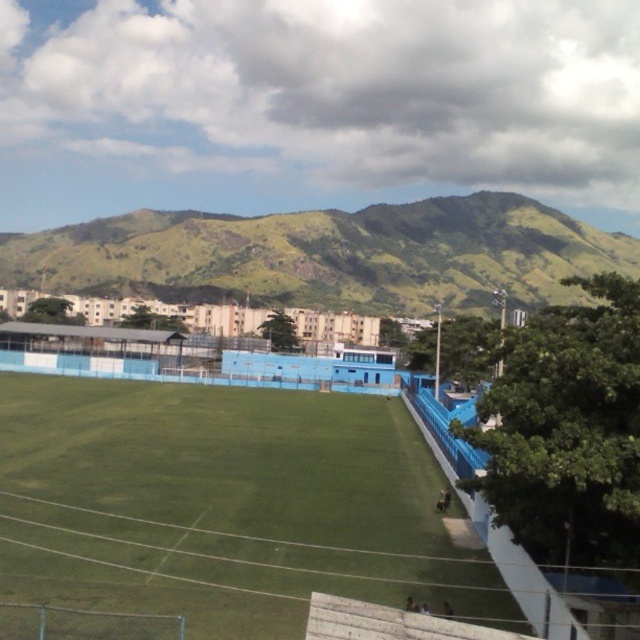
Question: Is the position of green grass football field at center more distant than that of green grassy hill at upper center?

Choices:
 (A) yes
 (B) no

Answer: (B)

Question: Which point is closer to the camera taking this photo?

Choices:
 (A) (410, 586)
 (B) (10, 262)

Answer: (A)

Question: Is green grass football field at center below green grassy hill at upper center?

Choices:
 (A) no
 (B) yes

Answer: (B)

Question: Which of the following is the closest to the observer?

Choices:
 (A) green grassy hill at upper center
 (B) green grass football field at center

Answer: (B)

Question: Does green grass football field at center appear on the left side of green grassy hill at upper center?

Choices:
 (A) no
 (B) yes

Answer: (B)